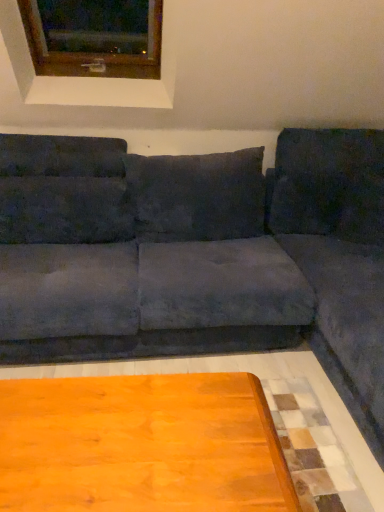
At what (x,y) coordinates should I click in order to perform the action: click on free space above suede-like dark gray pillow at upper left, positioned as the 3th pillow in right-to-left order (from a real-world perspective). Please return your answer as a coordinate pair (x, y). Image resolution: width=384 pixels, height=512 pixels. Looking at the image, I should click on (50, 174).